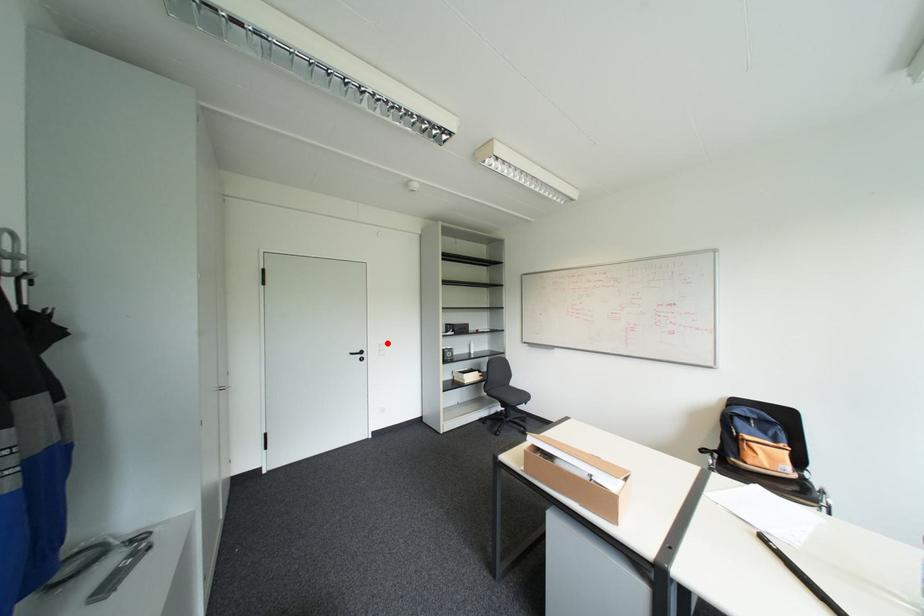
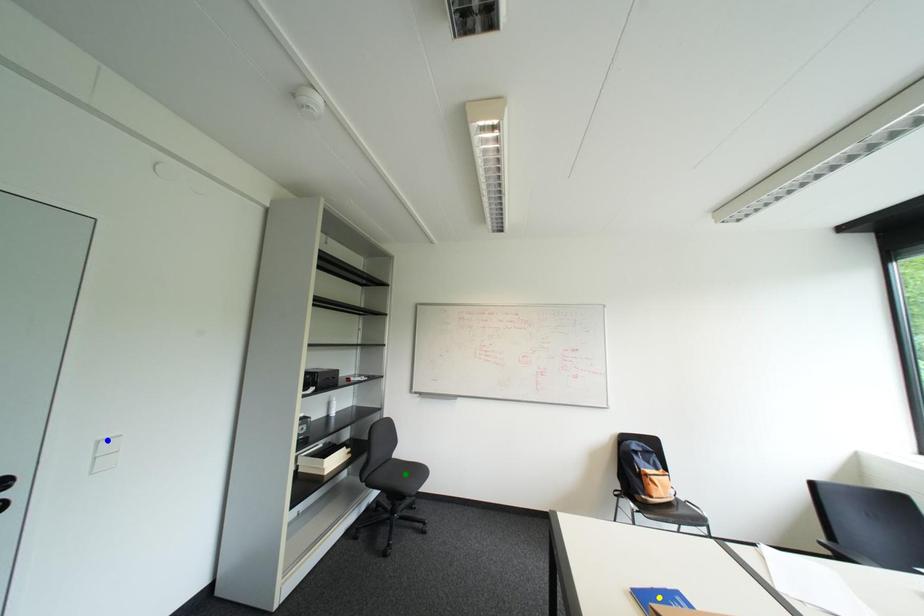
Question: I am providing you with two images of the same scene from different viewpoints. A red point is marked on the first image. You are given multiple points on the second image. Which point in image 2 represents the same 3d spot as the red point in image 1?

Choices:
 (A) yellow point
 (B) blue point
 (C) green point

Answer: (B)